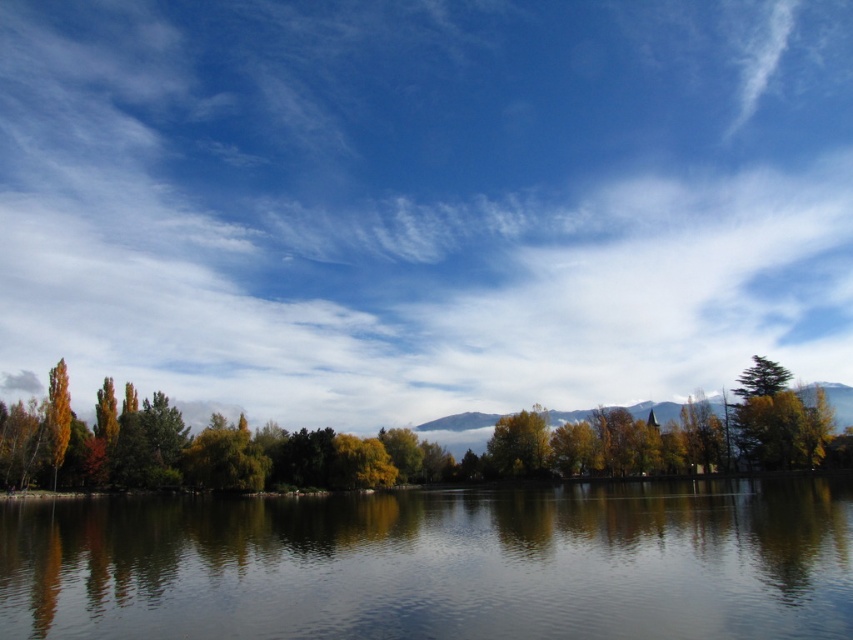
Question: Can you confirm if white fluffy cloud at upper center is positioned to the right of glossy reflective water at center?

Choices:
 (A) no
 (B) yes

Answer: (B)

Question: Which object is the farthest from the golden yellow leaves at center?

Choices:
 (A) orange matte tree at left
 (B) golden yellow leaves at left
 (C) white fluffy cloud at upper center

Answer: (C)

Question: Does glossy reflective water at center appear over orange matte tree at left?

Choices:
 (A) yes
 (B) no

Answer: (B)

Question: Is green leafy tree at center to the left of orange matte tree at left from the viewer's perspective?

Choices:
 (A) no
 (B) yes

Answer: (A)

Question: Which object is closer to the camera taking this photo?

Choices:
 (A) orange matte tree at left
 (B) golden yellow leaves at center
 (C) golden yellow leaves at left

Answer: (C)

Question: Which object appears closest to the camera in this image?

Choices:
 (A) golden yellow leaves at center
 (B) golden yellow leaves at left
 (C) white fluffy cloud at upper center
 (D) orange matte tree at left

Answer: (B)